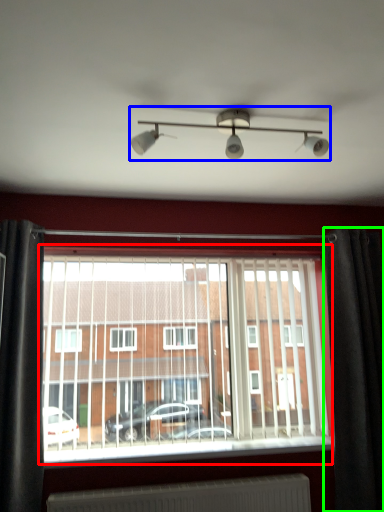
Question: Which object is the closest to the window (highlighted by a red box)? Choose among these: light fixture (highlighted by a blue box) or curtain (highlighted by a green box).

Choices:
 (A) light fixture
 (B) curtain

Answer: (B)